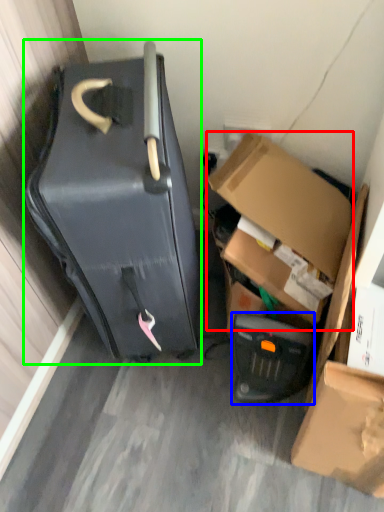
Question: Which object is the farthest from box (highlighted by a red box)? Choose among these: appliance (highlighted by a blue box) or suitcase (highlighted by a green box).

Choices:
 (A) appliance
 (B) suitcase

Answer: (B)